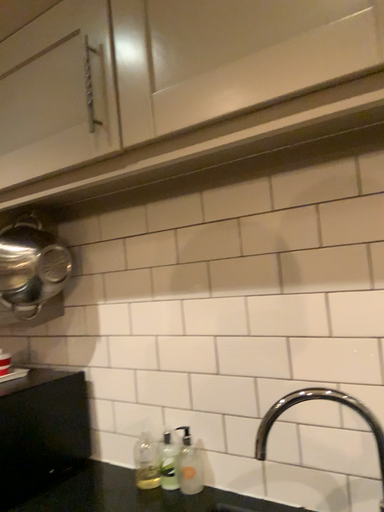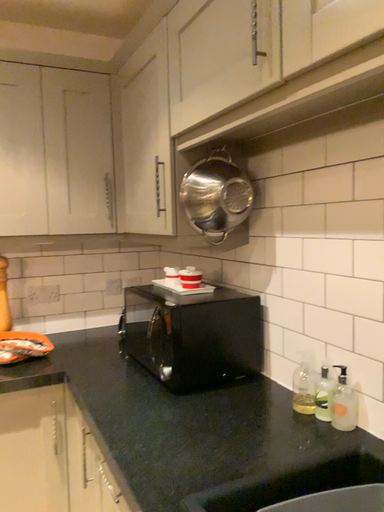
Question: Which way did the camera rotate in the video?

Choices:
 (A) rotated upward
 (B) rotated downward

Answer: (B)